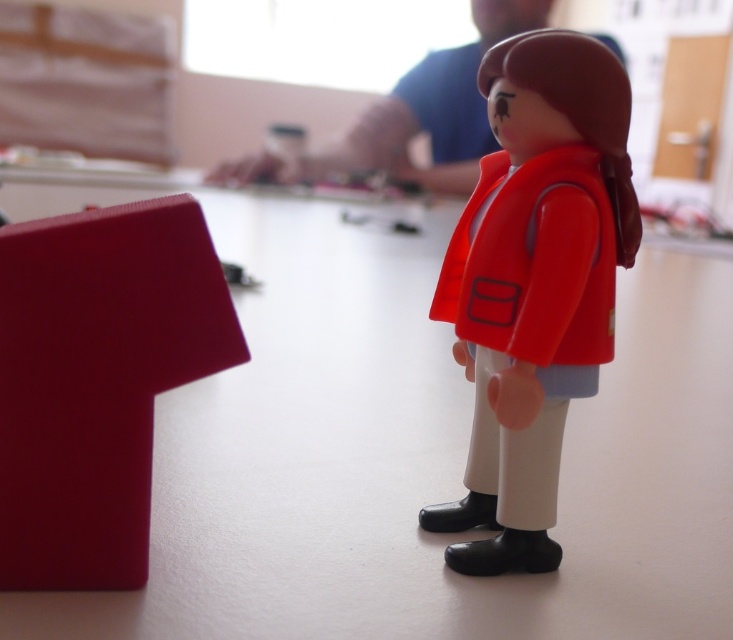
Who is lower down, matte plastic doll at center or matte plastic figure at upper center?

matte plastic doll at center

Is point (559, 307) positioned before point (347, 148)?

That is True.

Identify the location of matte plastic doll at center. (534, 284).